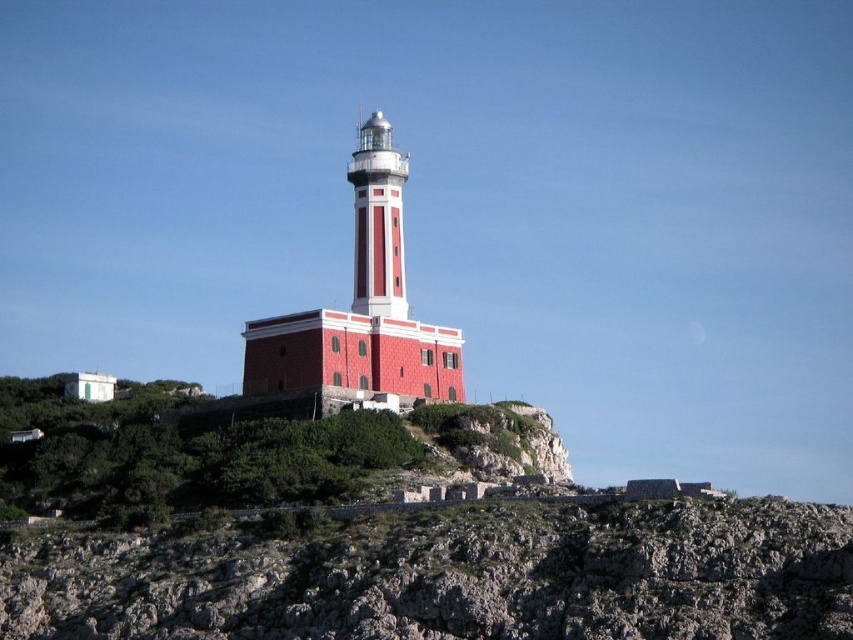
Which is behind, point (722, 516) or point (376, 152)?

Point (376, 152)

Looking at this image, is the position of rocky at center more distant than that of smooth red tower at center?

That is False.

Between point (595, 632) and point (396, 164), which one is positioned in front?

Point (595, 632) is more forward.

Locate an element on the screen. Image resolution: width=853 pixels, height=640 pixels. rocky at center is located at coordinates (454, 577).

In the scene shown: Is rocky at center closer to the viewer compared to red matte/lightweight tower at center?

Yes, rocky at center is closer to the viewer.

Who is more distant from viewer, (683, 579) or (398, 218)?

The point (398, 218) is more distant.

The image size is (853, 640). I want to click on rocky at center, so click(x=454, y=577).

Which is above, rocky at center or green grassy hillside at lower left?

green grassy hillside at lower left is above.

Which is more to the left, rocky at center or green grassy hillside at lower left?

green grassy hillside at lower left is more to the left.

Who is more distant from viewer, (614, 625) or (83, 403)?

Point (83, 403)

The height and width of the screenshot is (640, 853). Identify the location of rocky at center. (454, 577).